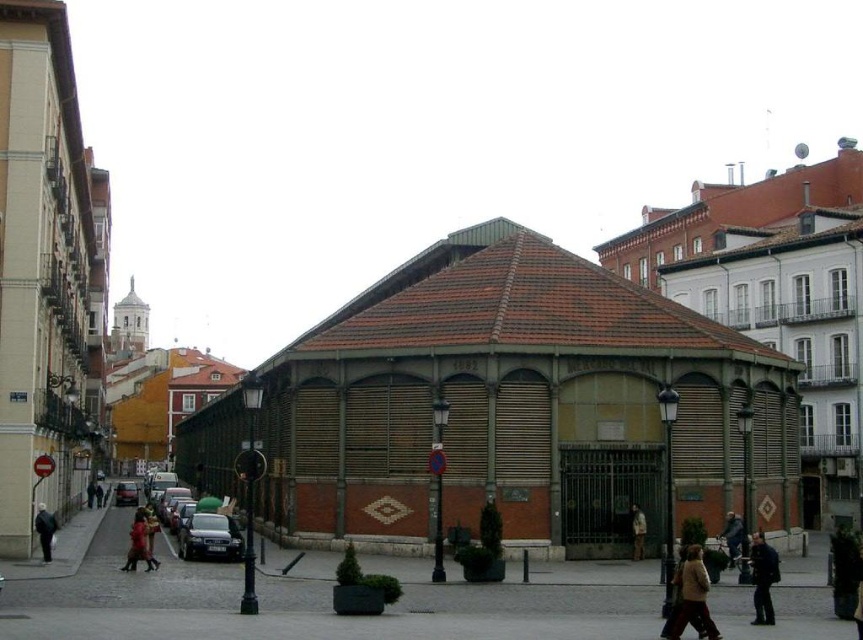
Question: Can you confirm if light brown leather jacket at lower right is wider than dark brown leather jacket at center?

Choices:
 (A) no
 (B) yes

Answer: (B)

Question: In this image, where is dark blue jacket at lower right located relative to red cotton shirt at center?

Choices:
 (A) right
 (B) left

Answer: (A)

Question: Is the position of dark blue jacket at lower right more distant than that of red cotton shirt at center?

Choices:
 (A) no
 (B) yes

Answer: (A)

Question: Which object is closer to the camera taking this photo?

Choices:
 (A) dark gray jacket at lower left
 (B) dark blue jacket at lower right
 (C) red cotton shirt at center
 (D) dark brown leather jacket at center

Answer: (B)

Question: Which of the following is the closest to the observer?

Choices:
 (A) coord(146,557)
 (B) coord(643,538)
 (C) coord(772,552)
 (D) coord(47,515)

Answer: (C)

Question: Among these points, which one is nearest to the camera?

Choices:
 (A) (142, 538)
 (B) (728, 561)

Answer: (B)